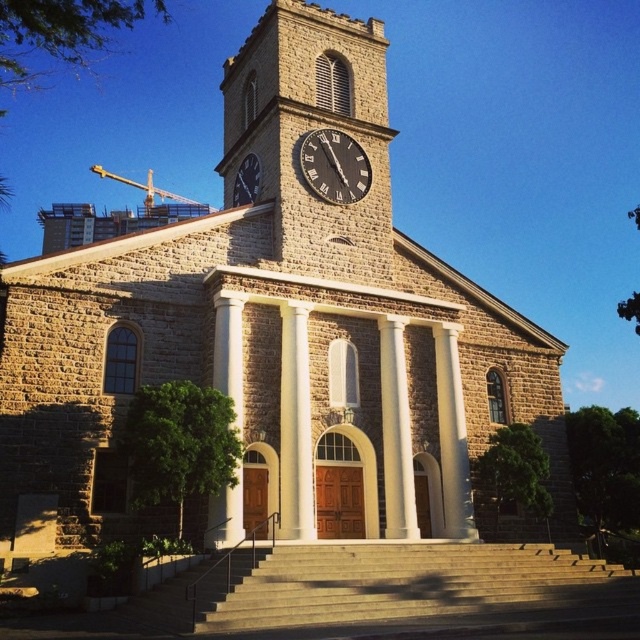
Question: Which object is the closest to the black matte clock at center?

Choices:
 (A) brown stone clock tower at upper center
 (B) dark gray stone clock at upper center

Answer: (A)

Question: From the image, what is the correct spatial relationship of brown stone clock tower at upper center in relation to black matte clock at center?

Choices:
 (A) left
 (B) right

Answer: (A)

Question: Which point is farther from the camera taking this photo?

Choices:
 (A) (308, 132)
 (B) (241, 177)
 (C) (340, 230)

Answer: (B)

Question: Is brown stone clock tower at upper center positioned in front of dark gray stone clock at upper center?

Choices:
 (A) no
 (B) yes

Answer: (B)

Question: Estimate the real-world distances between objects in this image. Which object is farther from the brown stone clock tower at upper center?

Choices:
 (A) black matte clock at center
 (B) dark gray stone clock at upper center

Answer: (B)

Question: In this image, where is black matte clock at center located relative to dark gray stone clock at upper center?

Choices:
 (A) left
 (B) right

Answer: (B)